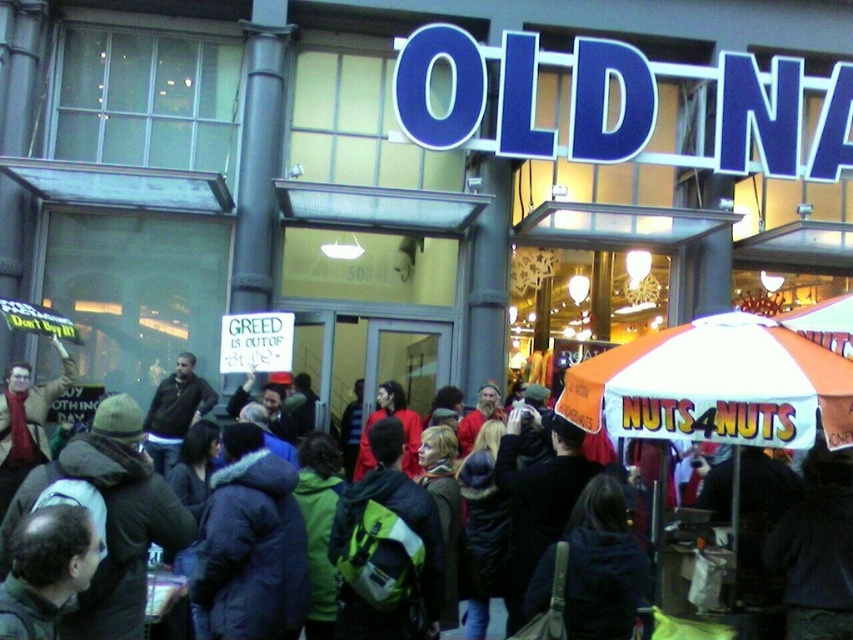
Question: Which object is closer to the camera taking this photo?

Choices:
 (A) orange/white fabric umbrella at right
 (B) dark brown leather jacket at center

Answer: (A)

Question: Can you confirm if orange/white fabric umbrella at right is positioned above dark brown leather jacket at center?

Choices:
 (A) no
 (B) yes

Answer: (B)

Question: Is orange/white fabric umbrella at right bigger than dark brown leather jacket at center?

Choices:
 (A) yes
 (B) no

Answer: (A)

Question: In this image, where is orange/white fabric umbrella at right located relative to dark brown leather jacket at center?

Choices:
 (A) right
 (B) left

Answer: (A)